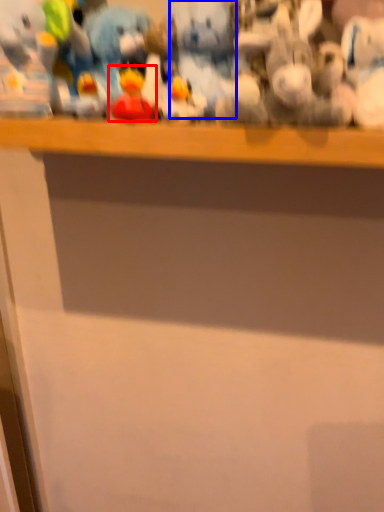
Question: Which object is closer to the camera taking this photo, toy (highlighted by a red box) or toy (highlighted by a blue box)?

Choices:
 (A) toy
 (B) toy

Answer: (A)